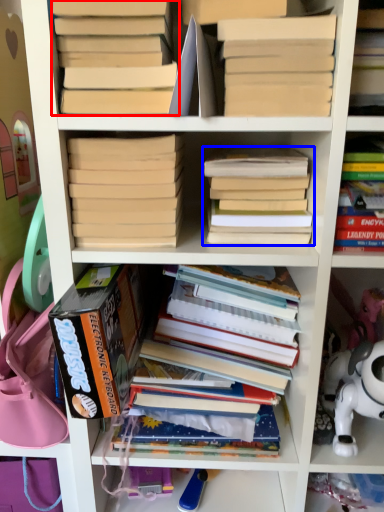
Question: Among these objects, which one is farthest to the camera, book (highlighted by a red box) or book (highlighted by a blue box)?

Choices:
 (A) book
 (B) book

Answer: (B)